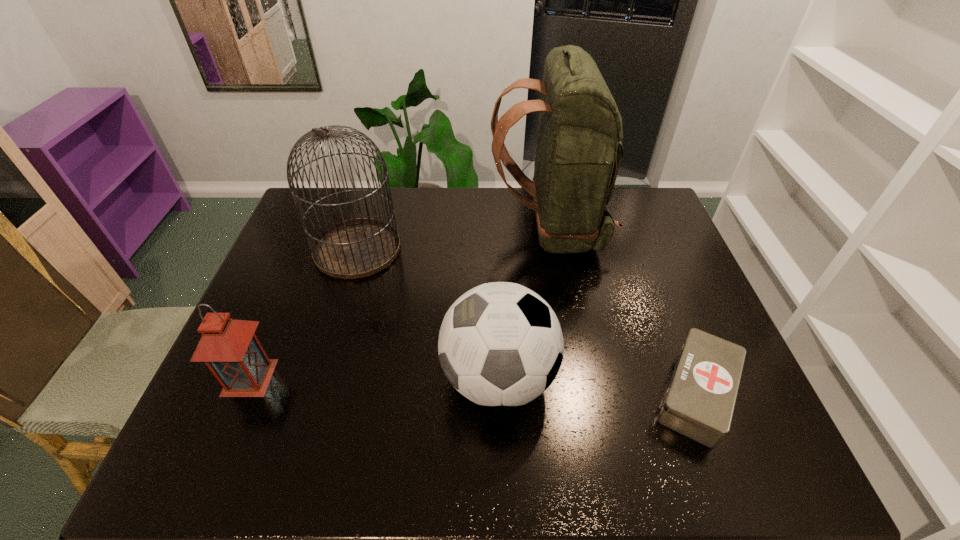
Identify the location of vacant region between the tallest object and the birdcage. Image resolution: width=960 pixels, height=540 pixels. (453, 239).

Identify the location of vacant space in between the tallest object and the first-aid kit. The height and width of the screenshot is (540, 960). (623, 312).

Locate an element on the screen. This screenshot has width=960, height=540. empty space that is in between the soccer ball and the shortest object is located at coordinates (597, 386).

Select which object appears as the third closest to the lantern. Please provide its 2D coordinates. Your answer should be formatted as a tuple, i.e. [(x, y)], where the tuple contains the x and y coordinates of a point satisfying the conditions above.

[(578, 154)]

Find the location of a particular element. The height and width of the screenshot is (540, 960). object identified as the fourth closest to the soccer ball is located at coordinates (231, 350).

Image resolution: width=960 pixels, height=540 pixels. Find the location of `free space that satisfies the following two spatial constraints: 1. on the back of the backpack; 2. on the back side of the shortest object`. free space that satisfies the following two spatial constraints: 1. on the back of the backpack; 2. on the back side of the shortest object is located at coordinates (578, 394).

Locate an element on the screen. The width and height of the screenshot is (960, 540). free space that satisfies the following two spatial constraints: 1. on the main logo of the soccer ball; 2. on the right side of the shortest object is located at coordinates (499, 394).

In order to click on free point that satisfies the following two spatial constraints: 1. on the main logo of the soccer ball; 2. on the left side of the first-aid kit in this screenshot , I will do `click(499, 394)`.

Identify the location of vacant space that satisfies the following two spatial constraints: 1. on the back of the backpack; 2. on the back side of the first-aid kit. (578, 394).